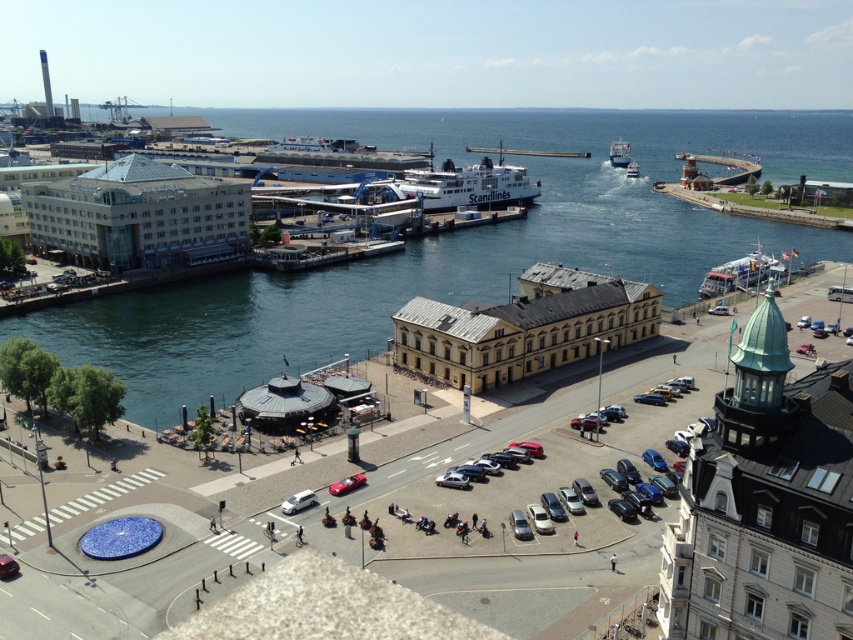
You are standing at the parking lot in the foreground and want to walk directly to the blue water at center. What direction should you head towards?

Since the blue water at center is located at coordinates point (450, 244), you should head towards the center area of the image to reach it.

Looking at this image, you are a drone operator who needs to fly a drone from the blue water at center to the white matte van at center. Given that the drone has a maximum range of 300 meters, will it be able to reach the van without recharging?

The blue water at center and white matte van at center are 308.80 meters apart from each other. Since the distance exceeds the drone s maximum range of 300 meters, the drone will not be able to reach the van without recharging.